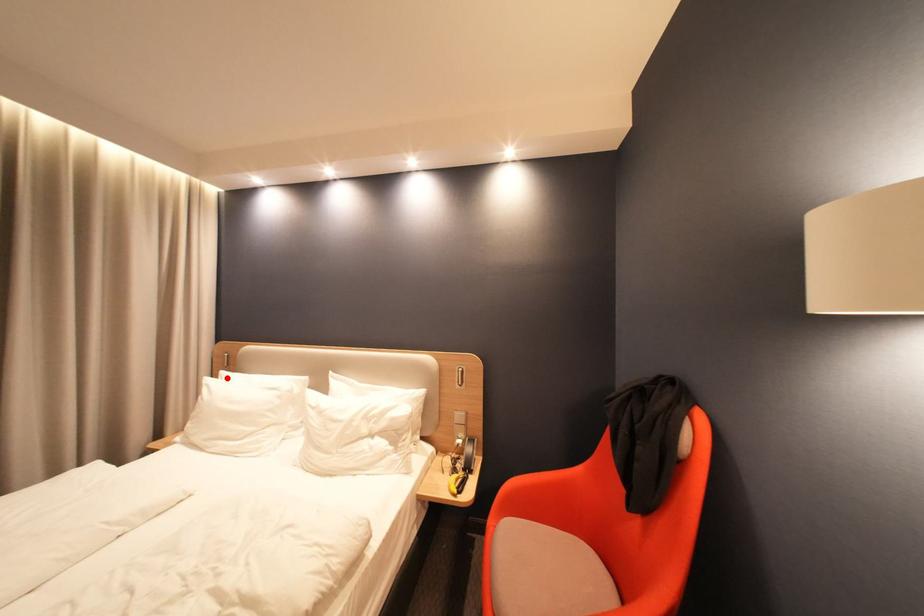
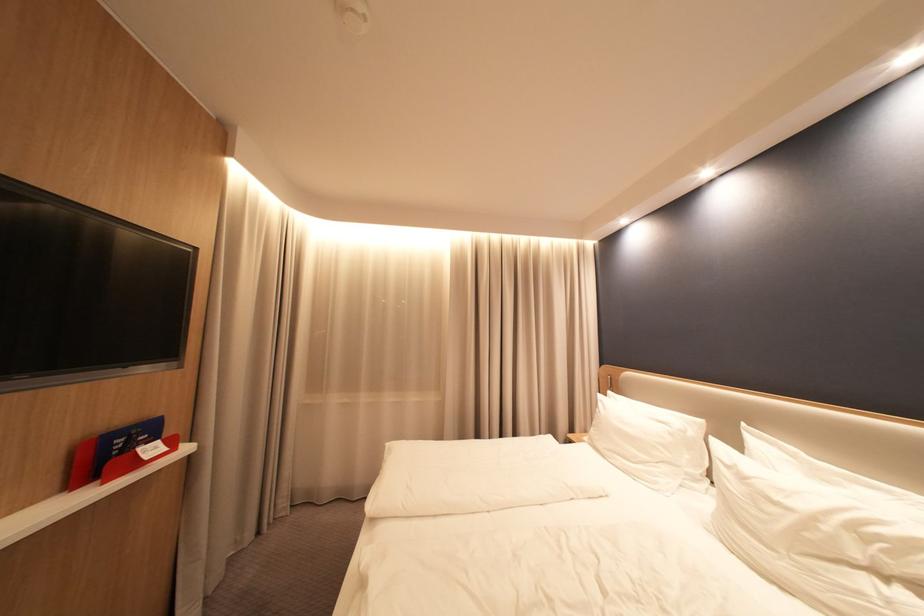
Question: I am providing you with two images of the same scene from different viewpoints. Image1 has a red point marked. In image2, the corresponding 3D location appears at what relative position? Reply with the corresponding letter.

Choices:
 (A) Closer
 (B) Farther

Answer: (B)